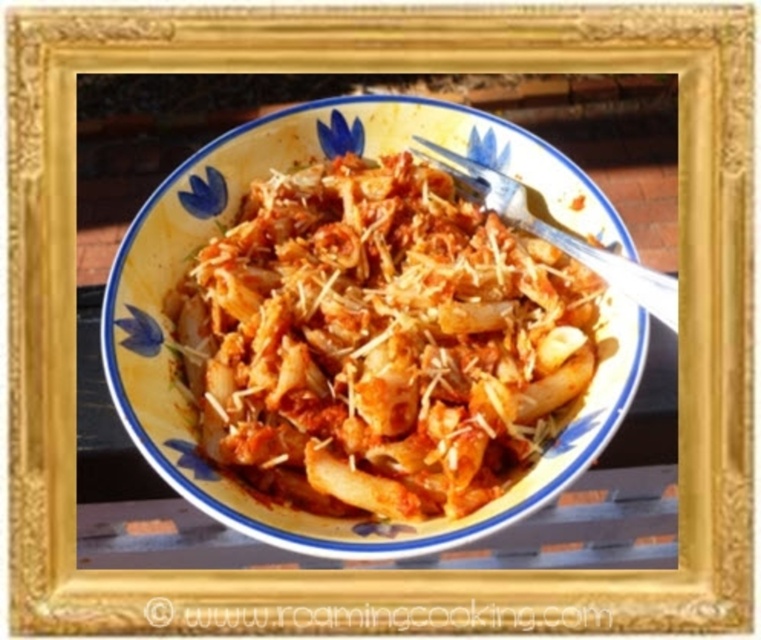
Does reddish-brown glossy pasta at center have a lesser width compared to silver metallic fork at upper center?

In fact, reddish-brown glossy pasta at center might be wider than silver metallic fork at upper center.

Does reddish-brown glossy pasta at center have a greater height compared to silver metallic fork at upper center?

Correct, reddish-brown glossy pasta at center is much taller as silver metallic fork at upper center.

Describe the element at coordinates (379, 340) in the screenshot. The width and height of the screenshot is (761, 640). I see `reddish-brown glossy pasta at center` at that location.

I want to click on reddish-brown glossy pasta at center, so tap(379, 340).